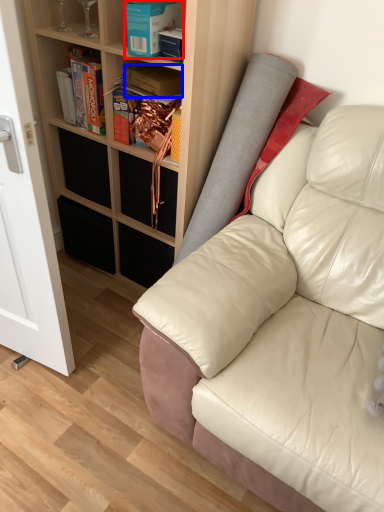
Question: Which object appears closest to the camera in this image, book (highlighted by a red box) or book (highlighted by a blue box)?

Choices:
 (A) book
 (B) book

Answer: (A)